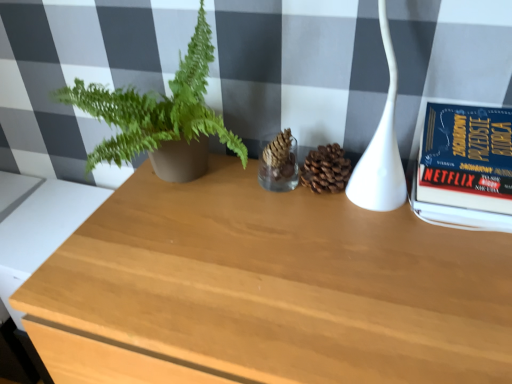
Identify the location of empty space that is ontop of wooden table at center, which appears as the second table when viewed from the left (from a real-world perspective). (x=307, y=246).